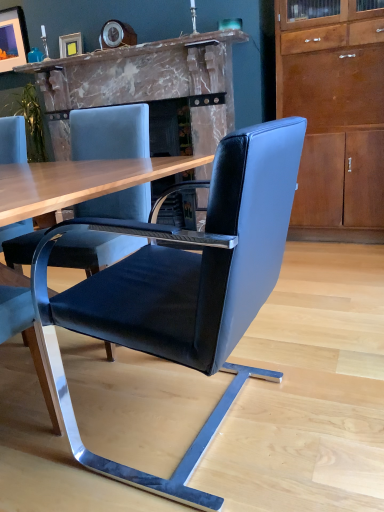
What do you see at coordinates (13, 39) in the screenshot? I see `matte black picture frame at upper left, the 2th picture frame when ordered from right to left` at bounding box center [13, 39].

The width and height of the screenshot is (384, 512). What do you see at coordinates (144, 83) in the screenshot? I see `marble fireplace at center` at bounding box center [144, 83].

Image resolution: width=384 pixels, height=512 pixels. I want to click on matte brown cabinet at right, so click(x=335, y=119).

Describe the element at coordinates (335, 119) in the screenshot. This screenshot has width=384, height=512. I see `matte brown cabinet at right` at that location.

Locate an element on the screen. This screenshot has height=512, width=384. black leather chair at center is located at coordinates (184, 288).

This screenshot has height=512, width=384. Find the location of `fireplace on the right side of matte gold picture frame at upper center, acting as the first picture frame starting from the right`. fireplace on the right side of matte gold picture frame at upper center, acting as the first picture frame starting from the right is located at coordinates (144, 83).

Is matte gold picture frame at upper center, which is the second picture frame from back to front, aimed at marble fireplace at center?

No, matte gold picture frame at upper center, which is the second picture frame from back to front, is not oriented towards marble fireplace at center.

Considering the positions of point (65, 49) and point (217, 128), is point (65, 49) closer or farther from the camera than point (217, 128)?

Point (65, 49).

From the image's perspective, which one is positioned lower, matte gold picture frame at upper center, the 2th picture frame from the left, or marble fireplace at center?

marble fireplace at center, from the image's perspective.

Based on the photo, from a real-world perspective, relative to black leather chair at center, is matte brown cabinet at right vertically above or below?

In terms of real-world spatial position, matte brown cabinet at right is above black leather chair at center.

Is matte brown cabinet at right directly adjacent to black leather chair at center?

No, matte brown cabinet at right is not touching black leather chair at center.

From the image's perspective, is matte brown cabinet at right below black leather chair at center?

No, from the image's perspective, matte brown cabinet at right is not below black leather chair at center.

Between matte brown cabinet at right and black leather chair at center, which one has larger size?

Bigger between the two is matte brown cabinet at right.

Where is `chair on the right of teal glass at upper center`? chair on the right of teal glass at upper center is located at coordinates (184, 288).

Is the position of teal glass at upper center less distant than that of black leather chair at center?

No, teal glass at upper center is further to the viewer.

Which point is more distant from viewer, (32, 56) or (278, 237)?

Point (32, 56)

In terms of height, does teal glass at upper center look taller or shorter compared to black leather chair at center?

Clearly, teal glass at upper center is shorter compared to black leather chair at center.

Is teal glass at upper center outside of matte gold picture frame at upper center, acting as the first picture frame starting from the right?

Absolutely, teal glass at upper center is external to matte gold picture frame at upper center, acting as the first picture frame starting from the right.

From the image's perspective, which object appears higher, teal glass at upper center or matte gold picture frame at upper center, which is the second picture frame from back to front?

matte gold picture frame at upper center, which is the second picture frame from back to front, is shown above in the image.

Which of these two, teal glass at upper center or matte gold picture frame at upper center, marked as the first picture frame in a front-to-back arrangement, is bigger?

Bigger between the two is matte gold picture frame at upper center, marked as the first picture frame in a front-to-back arrangement.

Is teal glass at upper center oriented away from matte gold picture frame at upper center, marked as the first picture frame in a front-to-back arrangement?

No, teal glass at upper center is not facing the opposite direction of matte gold picture frame at upper center, marked as the first picture frame in a front-to-back arrangement.

Could you tell me if marble fireplace at center is turned towards matte brown cabinet at right?

No, marble fireplace at center is not oriented towards matte brown cabinet at right.

How much distance is there between marble fireplace at center and matte brown cabinet at right?

A distance of 33.45 inches exists between marble fireplace at center and matte brown cabinet at right.

Is marble fireplace at center far away from matte brown cabinet at right?

Actually, marble fireplace at center and matte brown cabinet at right are a little close together.

From the image's perspective, would you say marble fireplace at center is shown under matte brown cabinet at right?

No, from the image's perspective, marble fireplace at center is not beneath matte brown cabinet at right.

Would you consider matte gold picture frame at upper center, which is the second picture frame from back to front, to be distant from matte black picture frame at upper left, the 2th picture frame when ordered from right to left?

No, matte gold picture frame at upper center, which is the second picture frame from back to front, is in close proximity to matte black picture frame at upper left, the 2th picture frame when ordered from right to left.

Which object is further away from the camera, matte gold picture frame at upper center, acting as the first picture frame starting from the right, or matte black picture frame at upper left, the 1th picture frame viewed from the top?

matte black picture frame at upper left, the 1th picture frame viewed from the top.

Is matte gold picture frame at upper center, marked as the first picture frame in a front-to-back arrangement, situated inside matte black picture frame at upper left, positioned as the first picture frame in back-to-front order, or outside?

matte gold picture frame at upper center, marked as the first picture frame in a front-to-back arrangement, is not inside matte black picture frame at upper left, positioned as the first picture frame in back-to-front order, it's outside.

Is matte gold picture frame at upper center, which is the second picture frame from back to front, bigger than matte black picture frame at upper left, which ranks as the 1th picture frame in left-to-right order?

No, matte gold picture frame at upper center, which is the second picture frame from back to front, is not bigger than matte black picture frame at upper left, which ranks as the 1th picture frame in left-to-right order.

Considering the sizes of objects teal glass at upper center and matte black picture frame at upper left, which is the second picture frame from front to back, in the image provided, who is taller, teal glass at upper center or matte black picture frame at upper left, which is the second picture frame from front to back,?

Standing taller between the two is matte black picture frame at upper left, which is the second picture frame from front to back.

There is a teal glass at upper center. Find the location of `the 2nd picture frame above it (from the image's perspective)`. the 2nd picture frame above it (from the image's perspective) is located at coordinates (13, 39).

Visually, is teal glass at upper center positioned to the left or to the right of matte black picture frame at upper left, positioned as the first picture frame in back-to-front order?

In the image, teal glass at upper center appears on the right side of matte black picture frame at upper left, positioned as the first picture frame in back-to-front order.

Considering the relative positions of teal glass at upper center and matte black picture frame at upper left, acting as the second picture frame starting from the bottom, in the image provided, is teal glass at upper center in front of matte black picture frame at upper left, acting as the second picture frame starting from the bottom,?

Yes, teal glass at upper center is in front of matte black picture frame at upper left, acting as the second picture frame starting from the bottom.

This screenshot has width=384, height=512. There is a marble fireplace at center. Identify the location of the 1st picture frame above it (from the image's perspective). (70, 45).

The height and width of the screenshot is (512, 384). I want to click on cabinetry located behind the black leather chair at center, so click(335, 119).

Estimate the real-world distances between objects in this image. Which object is further from black leather chair at center, matte brown cabinet at right or matte black picture frame at upper left, which ranks as the 1th picture frame in left-to-right order?

Based on the image, matte black picture frame at upper left, which ranks as the 1th picture frame in left-to-right order, appears to be further to black leather chair at center.

Looking at the image, which one is located closer to matte black picture frame at upper left, which ranks as the 1th picture frame in left-to-right order, marble fireplace at center or teal glass at upper center?

teal glass at upper center is positioned closer to the anchor matte black picture frame at upper left, which ranks as the 1th picture frame in left-to-right order.

Based on their spatial positions, is marble fireplace at center or black leather chair at center closer to matte brown cabinet at right?

Based on the image, marble fireplace at center appears to be nearer to matte brown cabinet at right.

Based on their spatial positions, is black leather chair at center or matte black picture frame at upper left, which is the second picture frame from front to back, further from teal glass at upper center?

black leather chair at center is further to teal glass at upper center.

Based on their spatial positions, is matte black picture frame at upper left, which is the second picture frame from front to back, or matte brown cabinet at right closer to matte gold picture frame at upper center, which is the second picture frame from back to front?

matte black picture frame at upper left, which is the second picture frame from front to back, is closer to matte gold picture frame at upper center, which is the second picture frame from back to front.

When comparing their distances from black leather chair at center, does matte black picture frame at upper left, the 2th picture frame when ordered from right to left, or teal glass at upper center seem further?

The object further to black leather chair at center is matte black picture frame at upper left, the 2th picture frame when ordered from right to left.

Estimate the real-world distances between objects in this image. Which object is closer to matte brown cabinet at right, teal glass at upper center or matte black picture frame at upper left, the 2th picture frame when ordered from right to left?

teal glass at upper center.

Looking at the image, which one is located further to marble fireplace at center, matte black picture frame at upper left, the 2th picture frame when ordered from right to left, or matte brown cabinet at right?

matte black picture frame at upper left, the 2th picture frame when ordered from right to left, lies further to marble fireplace at center than the other object.

This screenshot has height=512, width=384. I want to click on fireplace situated between matte black picture frame at upper left, which is the second picture frame from front to back, and matte brown cabinet at right from left to right, so click(144, 83).

I want to click on teal between black leather chair at center and matte black picture frame at upper left, positioned as the first picture frame in back-to-front order, from front to back, so click(35, 55).

The width and height of the screenshot is (384, 512). I want to click on fireplace located between matte gold picture frame at upper center, marked as the first picture frame in a front-to-back arrangement, and matte brown cabinet at right in the left-right direction, so click(144, 83).

Where is `picture frame between black leather chair at center and teal glass at upper center from front to back`? Image resolution: width=384 pixels, height=512 pixels. picture frame between black leather chair at center and teal glass at upper center from front to back is located at coordinates (70, 45).